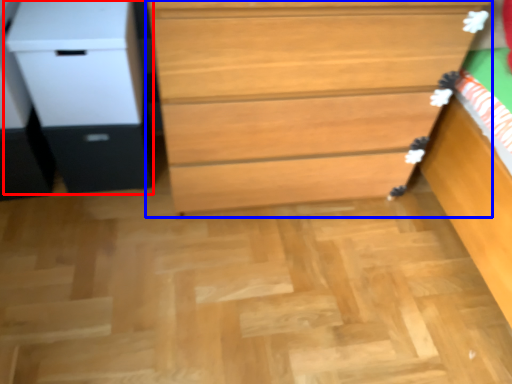
Question: Which object appears farthest to the camera in this image, file cabinet (highlighted by a red box) or chest of drawers (highlighted by a blue box)?

Choices:
 (A) file cabinet
 (B) chest of drawers

Answer: (A)